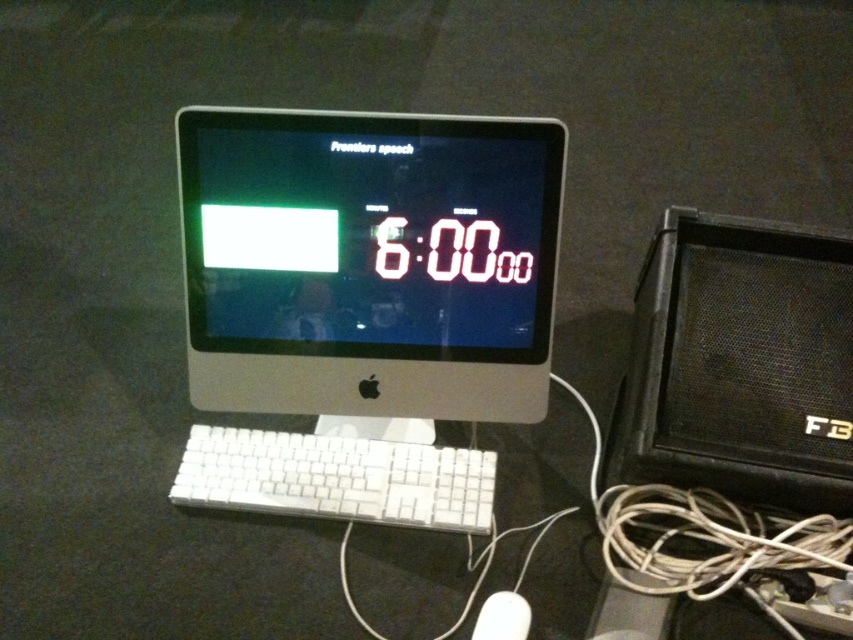
Who is positioned more to the left, white plastic monitor at center or white plastic mouse at lower center?

From the viewer's perspective, white plastic monitor at center appears more on the left side.

Does point (422, 372) come behind point (486, 609)?

Yes, point (422, 372) is behind point (486, 609).

Is point (492, 253) more distant than point (494, 612)?

Yes, point (492, 253) is behind point (494, 612).

Identify the location of white plastic monitor at center. (369, 260).

Between white plastic monitor at center and black textured speaker at right, which one has less height?

black textured speaker at right

Is white plastic monitor at center closer to the viewer compared to black textured speaker at right?

No, white plastic monitor at center is behind black textured speaker at right.

Image resolution: width=853 pixels, height=640 pixels. Find the location of `white plastic monitor at center`. white plastic monitor at center is located at coordinates (369, 260).

Can you confirm if white plastic keyboard at center is shorter than white plastic mouse at lower center?

Incorrect, white plastic keyboard at center's height does not fall short of white plastic mouse at lower center's.

This screenshot has width=853, height=640. I want to click on white plastic keyboard at center, so click(337, 477).